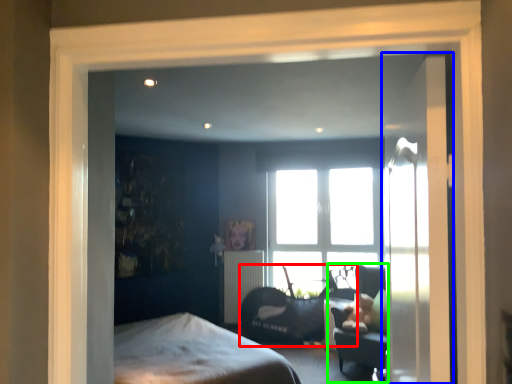
Question: Which object is the farthest from swivel chair (highlighted by a red box)? Choose among these: door (highlighted by a blue box) or swivel chair (highlighted by a green box).

Choices:
 (A) door
 (B) swivel chair

Answer: (A)